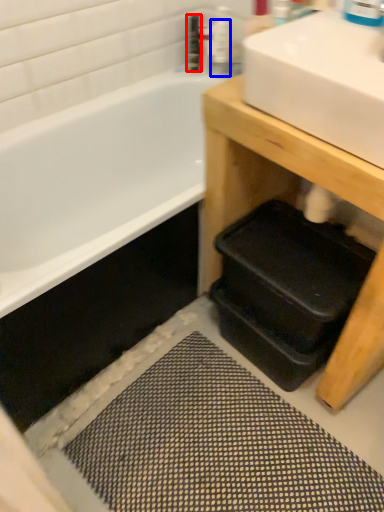
Question: Among these objects, which one is farthest to the camera, toiletry (highlighted by a red box) or toiletry (highlighted by a blue box)?

Choices:
 (A) toiletry
 (B) toiletry

Answer: (A)